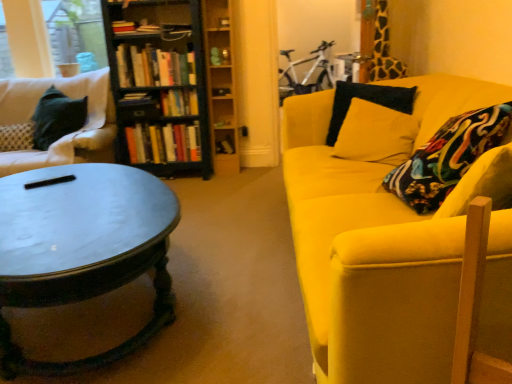
Identify the location of free spot below matte black coffee table at left (from a real-world perspective). (99, 327).